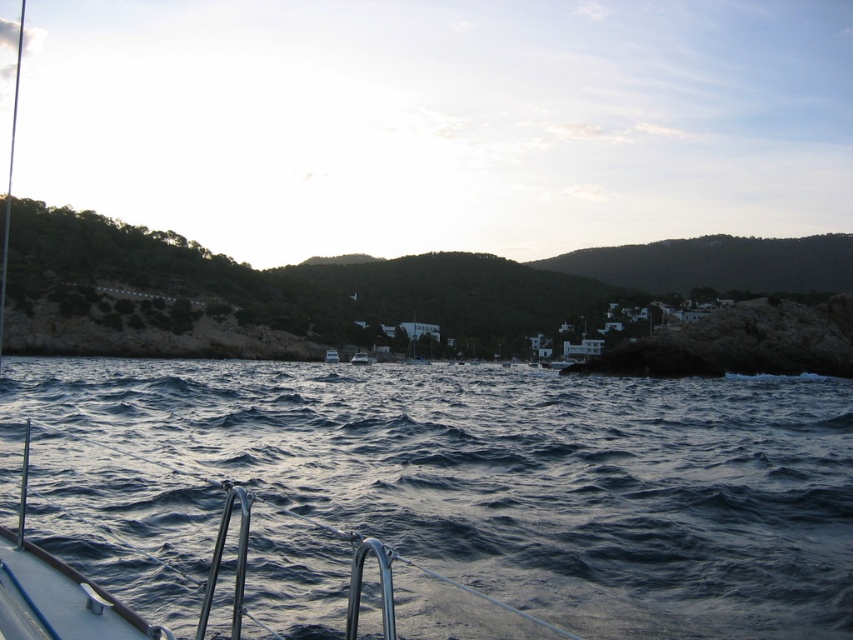
Question: Does white glossy boat at center lie behind metallic silver boat at center?

Choices:
 (A) no
 (B) yes

Answer: (A)

Question: Which object is closer to the camera taking this photo?

Choices:
 (A) green grassy hill at upper center
 (B) white glossy boat at center
 (C) metallic silver boat at center
 (D) dark blue water at center

Answer: (D)

Question: Among these points, which one is nearest to the camera?

Choices:
 (A) (363, 352)
 (B) (619, 596)
 (C) (335, 349)

Answer: (B)

Question: Can you confirm if dark blue water at center is positioned below white glossy boat at center?

Choices:
 (A) yes
 (B) no

Answer: (B)

Question: Is dark blue water at center to the left of green grassy hill at upper center from the viewer's perspective?

Choices:
 (A) no
 (B) yes

Answer: (B)

Question: Based on their relative distances, which object is farther from the metallic silver boat at center?

Choices:
 (A) dark blue water at center
 (B) green grassy hill at upper center

Answer: (A)